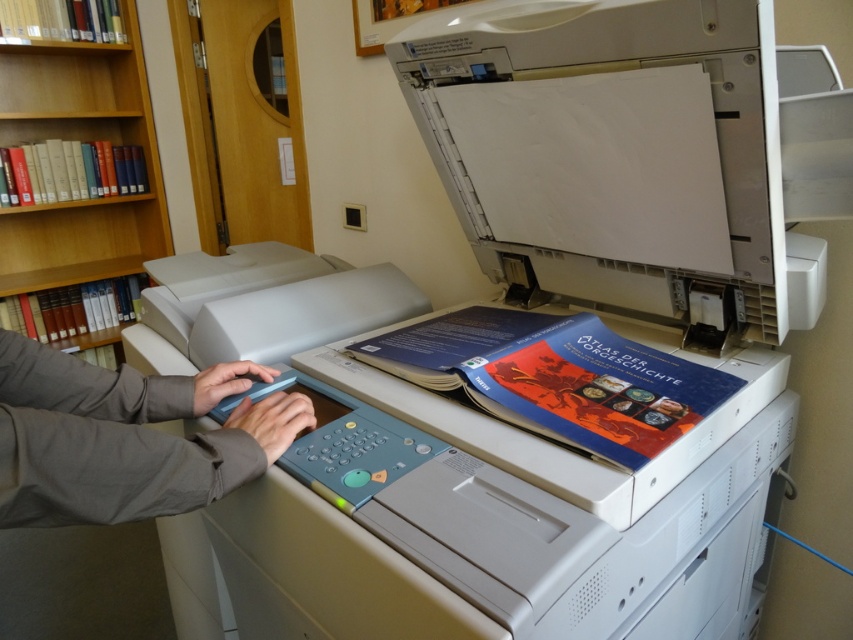
Question: Considering the real-world distances, which object is closest to the gray fabric hands at center?

Choices:
 (A) white plastic printer at center
 (B) wooden bookshelf at left

Answer: (A)

Question: Is wooden bookshelf at left in front of white plastic printer at center?

Choices:
 (A) yes
 (B) no

Answer: (B)

Question: Which point is closer to the camera taking this photo?

Choices:
 (A) (44, 419)
 (B) (18, 284)

Answer: (A)

Question: Which point is farther to the camera?

Choices:
 (A) (26, 504)
 (B) (248, 291)
 (C) (19, 61)

Answer: (C)

Question: Can you confirm if gray fabric hands at center is wider than wooden bookshelf at left?

Choices:
 (A) no
 (B) yes

Answer: (A)

Question: Is gray fabric hands at center in front of wooden bookshelf at left?

Choices:
 (A) yes
 (B) no

Answer: (A)